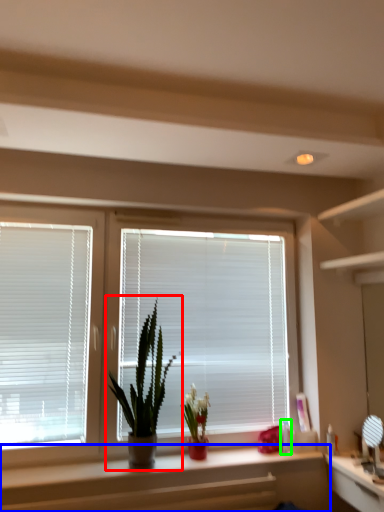
Question: Which object is positioned closest to houseplant (highlighted by a red box)? Select from counter (highlighted by a blue box) and toiletry (highlighted by a green box).

Choices:
 (A) counter
 (B) toiletry

Answer: (A)